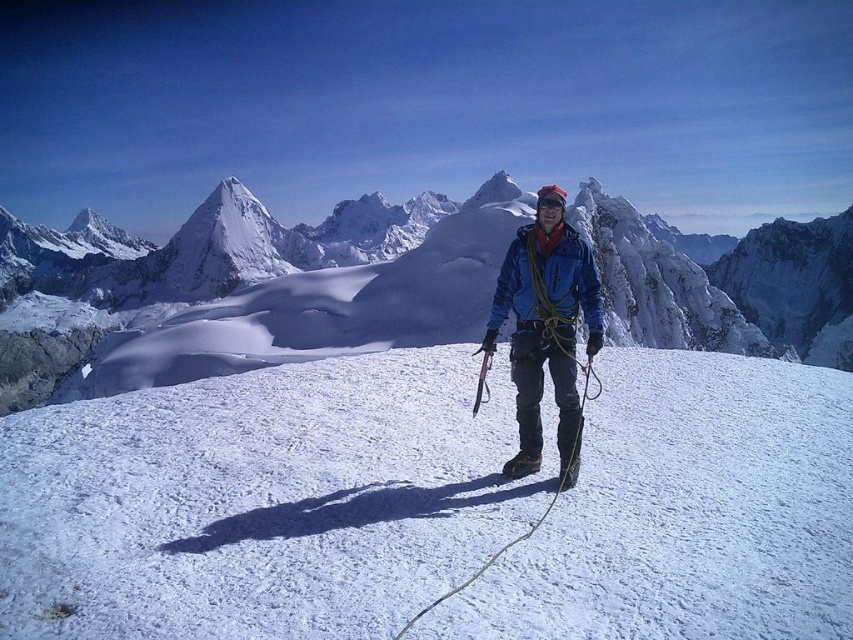
You are a photographer planning to take a photo of the climber. You want to ensure the blue fabric jacket at center is visible against the white frosty snow at center. Based on their positions, which object should you focus on to ensure the jacket stands out?

The white frosty snow at center is positioned on the left side of the blue fabric jacket at center. To ensure the jacket stands out against the snow, focus on the blue fabric jacket at center since it is adjacent to the lighter snow, creating contrast.